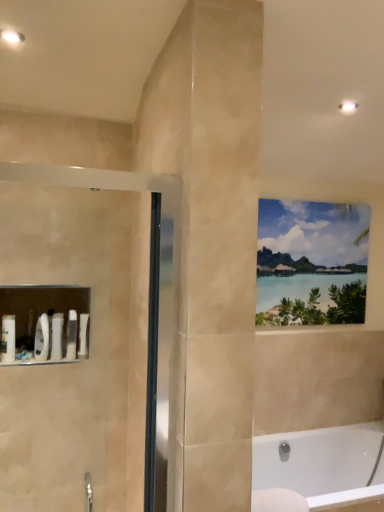
Describe the element at coordinates (318, 469) in the screenshot. I see `white glossy bathtub at lower right` at that location.

The image size is (384, 512). I want to click on white glossy bathtub at lower right, so click(318, 469).

Find the location of a particular element. The height and width of the screenshot is (512, 384). watercolor painting at upper right is located at coordinates (311, 262).

The image size is (384, 512). What do you see at coordinates (311, 262) in the screenshot?
I see `watercolor painting at upper right` at bounding box center [311, 262].

What is the approximate height of watercolor painting at upper right?

The height of watercolor painting at upper right is 32.98 inches.

Identify the location of white glossy bathtub at lower right. (318, 469).

Which object is positioned more to the right, white glossy bathtub at lower right or watercolor painting at upper right?

Positioned to the right is white glossy bathtub at lower right.

Between white glossy bathtub at lower right and watercolor painting at upper right, which one is positioned behind?

watercolor painting at upper right is behind.

Is point (337, 430) positioned in front of point (362, 301)?

Yes, point (337, 430) is in front of point (362, 301).

From the image's perspective, which one is positioned lower, white glossy bathtub at lower right or watercolor painting at upper right?

From the image's view, white glossy bathtub at lower right is below.

From a real-world perspective, is white glossy bathtub at lower right physically above watercolor painting at upper right?

No, from a real-world perspective, white glossy bathtub at lower right is not over watercolor painting at upper right

Between white glossy bathtub at lower right and watercolor painting at upper right, which one has larger width?

white glossy bathtub at lower right.

Considering the sizes of objects white glossy bathtub at lower right and watercolor painting at upper right in the image provided, who is taller, white glossy bathtub at lower right or watercolor painting at upper right?

With more height is watercolor painting at upper right.

Does white glossy bathtub at lower right have a smaller size compared to watercolor painting at upper right?

Incorrect, white glossy bathtub at lower right is not smaller in size than watercolor painting at upper right.

Do you think white glossy bathtub at lower right is within watercolor painting at upper right, or outside of it?

white glossy bathtub at lower right cannot be found inside watercolor painting at upper right.

Is white glossy bathtub at lower right in contact with watercolor painting at upper right?

No, white glossy bathtub at lower right is not with watercolor painting at upper right.

Is white glossy bathtub at lower right turned away from watercolor painting at upper right?

That's not correct — white glossy bathtub at lower right is not looking away from watercolor painting at upper right.

Identify the location of bathtub in front of the watercolor painting at upper right. This screenshot has width=384, height=512. (318, 469).

Which object is positioned more to the right, watercolor painting at upper right or white glossy bathtub at lower right?

white glossy bathtub at lower right is more to the right.

Is watercolor painting at upper right in front of or behind white glossy bathtub at lower right in the image?

In the image, watercolor painting at upper right appears behind white glossy bathtub at lower right.

Is point (332, 225) positioned in front of point (348, 500)?

No, (332, 225) is behind (348, 500).

From the image's perspective, does watercolor painting at upper right appear lower than white glossy bathtub at lower right?

No, from the image's perspective, watercolor painting at upper right is not beneath white glossy bathtub at lower right.

From a real-world perspective, which is physically above, watercolor painting at upper right or white glossy bathtub at lower right?

watercolor painting at upper right, from a real-world perspective.

In the scene shown: Can you confirm if watercolor painting at upper right is wider than white glossy bathtub at lower right?

No, watercolor painting at upper right is not wider than white glossy bathtub at lower right.

Considering the sizes of objects watercolor painting at upper right and white glossy bathtub at lower right in the image provided, who is taller, watercolor painting at upper right or white glossy bathtub at lower right?

watercolor painting at upper right.

Is watercolor painting at upper right bigger than white glossy bathtub at lower right?

Incorrect, watercolor painting at upper right is not larger than white glossy bathtub at lower right.

Is white glossy bathtub at lower right completely or partially inside watercolor painting at upper right?

No.

Is watercolor painting at upper right next to white glossy bathtub at lower right?

No.

Is watercolor painting at upper right aimed at white glossy bathtub at lower right?

No, watercolor painting at upper right is not turned towards white glossy bathtub at lower right.

Locate an element on the screen. The image size is (384, 512). bathtub lying below the watercolor painting at upper right (from the image's perspective) is located at coordinates (318, 469).

Identify the location of window above the white glossy bathtub at lower right (from a real-world perspective). Image resolution: width=384 pixels, height=512 pixels. (311, 262).

Identify the location of bathtub located below the watercolor painting at upper right (from the image's perspective). The height and width of the screenshot is (512, 384). (318, 469).